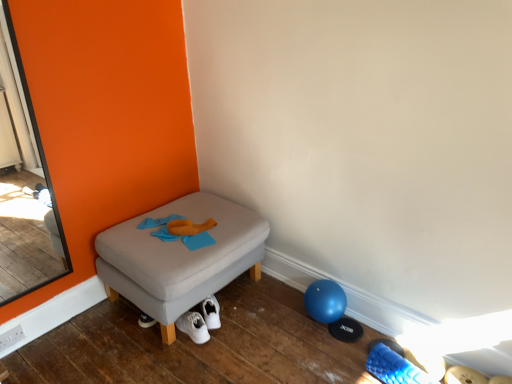
The width and height of the screenshot is (512, 384). Identify the location of free spot behind white fabric shoe at lower center. (382, 354).